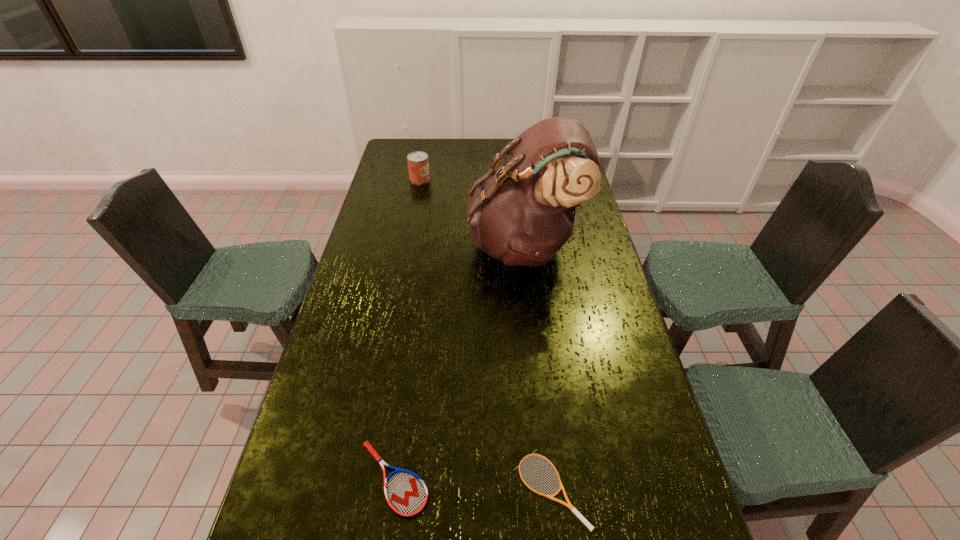
This screenshot has width=960, height=540. In order to click on the tallest object in this screenshot , I will do `click(522, 213)`.

You are a GUI agent. You are given a task and a screenshot of the screen. Output one action in this format:
    pyautogui.click(x=<x>, y=<y>)
    Task: Click on the satchel
    
    Given the screenshot: What is the action you would take?
    [522, 213]

This screenshot has height=540, width=960. Find the location of `the farthest object`. the farthest object is located at coordinates pos(418,165).

The image size is (960, 540). Identify the location of the third shortest object. click(418, 165).

Find the location of a particular element. the left tennis racket is located at coordinates (406, 493).

I want to click on the shorter tennis racket, so click(569, 505).

Locate an element on the screen. the shortest object is located at coordinates (569, 505).

Identify the location of free region located at the front of the tallest object with buckles. The image size is (960, 540). (386, 245).

The height and width of the screenshot is (540, 960). What are the coordinates of `vacant space situated 0.340m at the front of the tallest object with buckles` in the screenshot? It's located at (377, 245).

Locate an element on the screen. Image resolution: width=960 pixels, height=540 pixels. blank space located at the front of the tallest object with buckles is located at coordinates (383, 245).